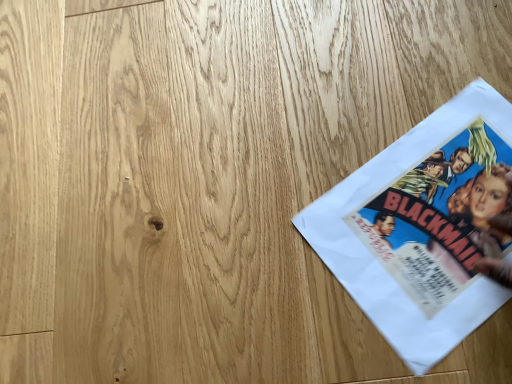
This screenshot has width=512, height=384. I want to click on vacant region above white paper at upper right (from a real-world perspective), so click(x=392, y=240).